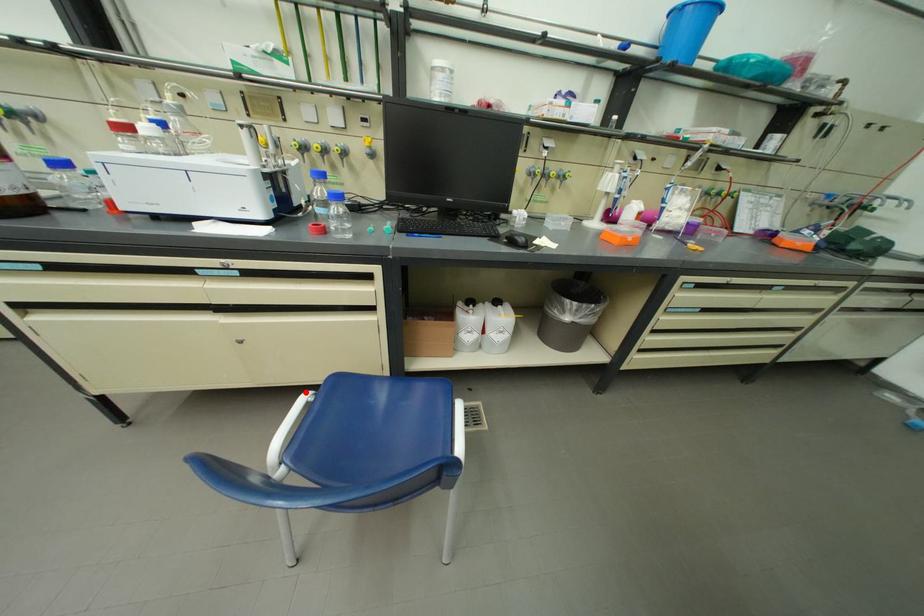
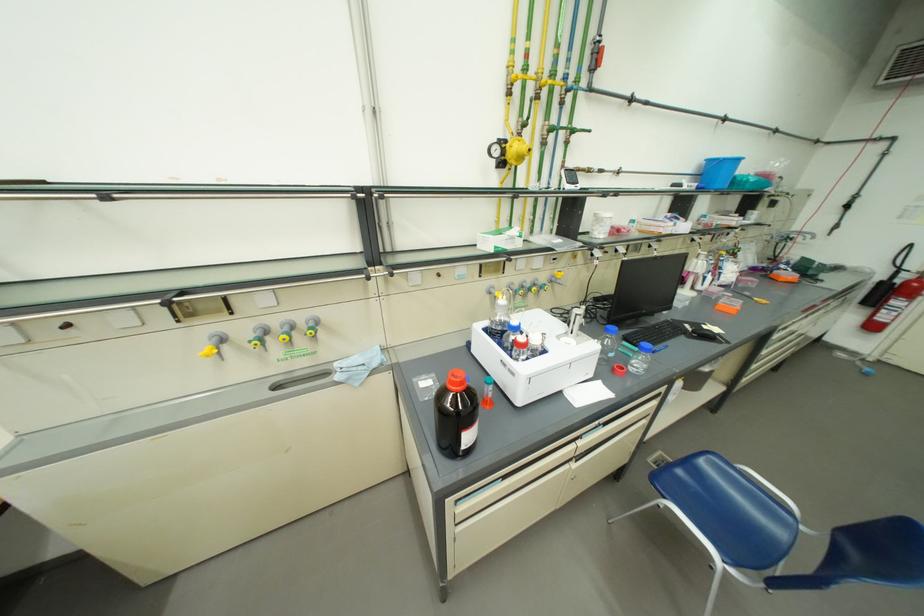
Where in the second image is the point corresponding to the highlighted location from the first image?

(673, 506)